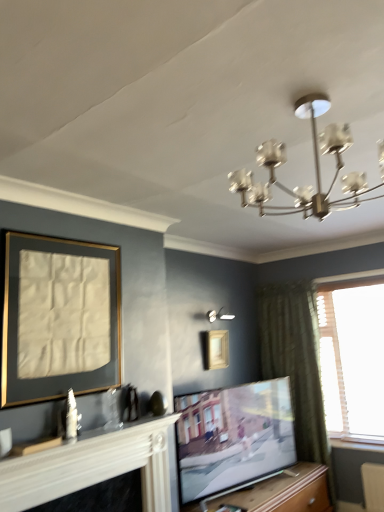
Question: Considering the relative sizes of matte black tv at center and white glossy wall sconce at upper center in the image provided, is matte black tv at center smaller than white glossy wall sconce at upper center?

Choices:
 (A) yes
 (B) no

Answer: (B)

Question: Is white glossy wall sconce at upper center surrounded by matte black tv at center?

Choices:
 (A) yes
 (B) no

Answer: (B)

Question: Would you say matte black tv at center is outside white glossy wall sconce at upper center?

Choices:
 (A) no
 (B) yes

Answer: (B)

Question: Is matte black tv at center shorter than white glossy wall sconce at upper center?

Choices:
 (A) yes
 (B) no

Answer: (B)

Question: Does matte black tv at center have a lesser width compared to white glossy wall sconce at upper center?

Choices:
 (A) no
 (B) yes

Answer: (B)

Question: From a real-world perspective, is matte black tv at center below white glossy wall sconce at upper center?

Choices:
 (A) yes
 (B) no

Answer: (A)

Question: Is wooden at center far away from white glossy wall sconce at upper center?

Choices:
 (A) yes
 (B) no

Answer: (A)

Question: Is wooden at center positioned with its back to white glossy wall sconce at upper center?

Choices:
 (A) yes
 (B) no

Answer: (B)

Question: Is wooden at center wider than white glossy wall sconce at upper center?

Choices:
 (A) no
 (B) yes

Answer: (B)

Question: From the image's perspective, is wooden at center located above white glossy wall sconce at upper center?

Choices:
 (A) yes
 (B) no

Answer: (B)

Question: Can you confirm if wooden at center is positioned to the right of white glossy wall sconce at upper center?

Choices:
 (A) no
 (B) yes

Answer: (B)

Question: Is wooden at center thinner than white glossy wall sconce at upper center?

Choices:
 (A) no
 (B) yes

Answer: (A)

Question: Is wooden picture frame at upper center, which is the second picture frame in left-to-right order, not within matte gold picture frame at left, which is counted as the 2th picture frame, starting from the right?

Choices:
 (A) no
 (B) yes

Answer: (B)